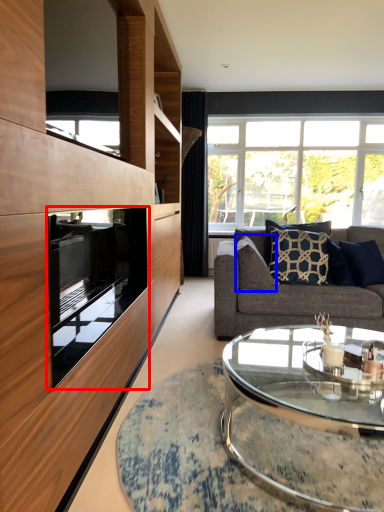
Question: Which object appears closest to the camera in this image, oven (highlighted by a red box) or pillow (highlighted by a blue box)?

Choices:
 (A) oven
 (B) pillow

Answer: (A)